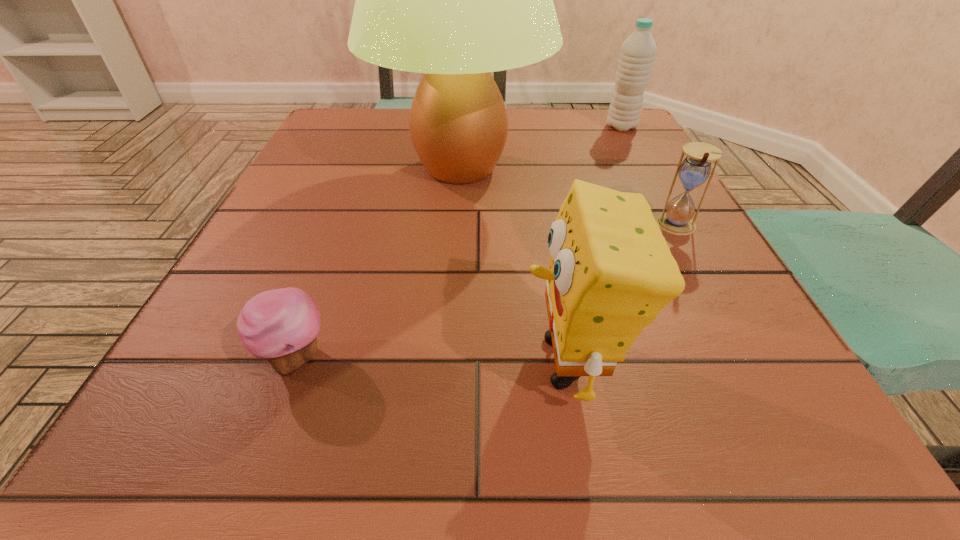
Where is `object that is positioned at the far right corner`? The width and height of the screenshot is (960, 540). object that is positioned at the far right corner is located at coordinates (638, 51).

Identify the location of free point at the far edge. Image resolution: width=960 pixels, height=540 pixels. [512, 135].

In the image, there is a desktop. Where is `free region at the near edge`? free region at the near edge is located at coordinates (627, 411).

In the image, there is a desktop. Where is `vacant area at the left edge`? Image resolution: width=960 pixels, height=540 pixels. vacant area at the left edge is located at coordinates [233, 319].

Where is `free space at the right edge of the desktop`? free space at the right edge of the desktop is located at coordinates (639, 167).

This screenshot has width=960, height=540. In the image, there is a desktop. What are the coordinates of `vacant area at the far left corner` in the screenshot? It's located at (306, 147).

In the image, there is a desktop. Identify the location of vacant region at the near left corner. (274, 444).

Find the location of a particular element. vacant space at the far right corner of the desktop is located at coordinates (565, 109).

This screenshot has height=540, width=960. I want to click on free region at the near right corner of the desktop, so click(x=744, y=459).

Find the location of a particular element. free space that is in between the lampshade and the shortest object is located at coordinates (377, 263).